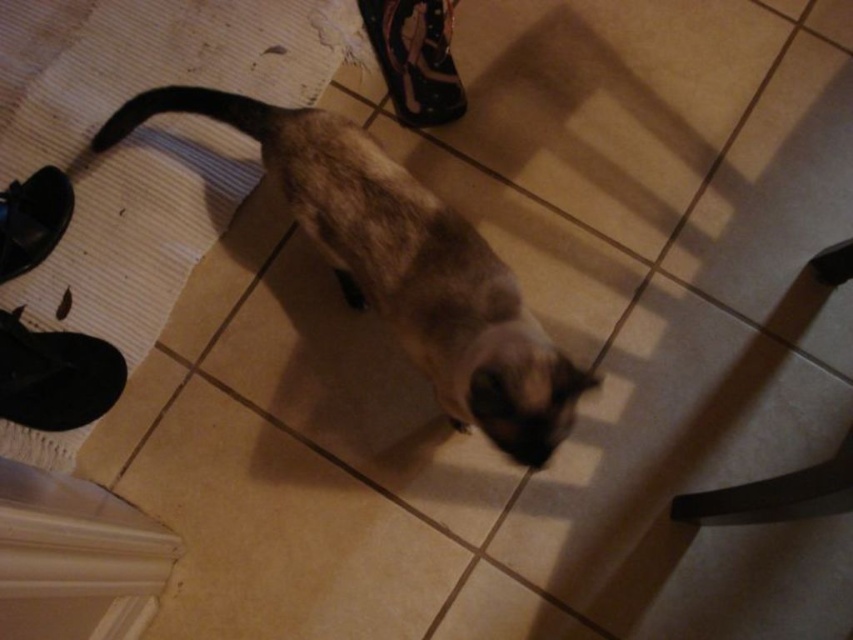
You are a cat in the scene. You see a black suede shoe at lower left and a black suede sneaker at upper center. Which object is closer to the floor?

The black suede shoe at lower left is closer to the floor because it is located below the black suede sneaker at upper center.

You are a pet sitter who needs to place a small toy between the brown fur cat at center and the black rubber shoe at left. Since you want the toy to be accessible to both, where should you place it?

The toy should be placed between the brown fur cat at center and the black rubber shoe at left, as this position ensures equal accessibility for both. However, since the brown fur cat at center is taller than the black rubber shoe at left, the cat might have an easier time reaching the toy.

You are a pet sitter who needs to place a small toy between the brown fur cat at center and the black suede shoe at lower left. Since the cat is larger, where should you place the toy so it doesn

The brown fur cat at center is wider than the black suede shoe at lower left. To place the toy between them, position it closer to the shoe since the cat takes up more space.